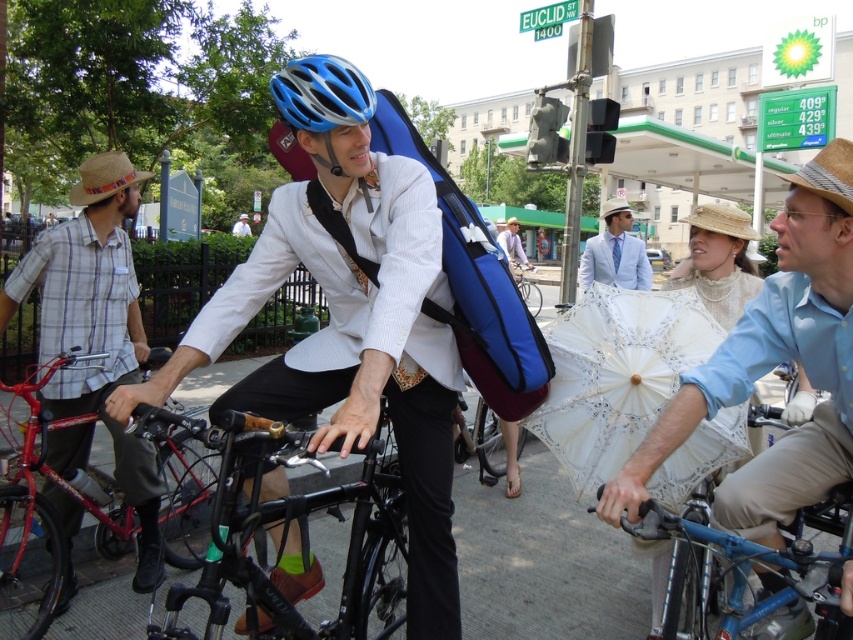
Question: Does gray concrete pavement at center lie behind light blue fabric suit at center?

Choices:
 (A) no
 (B) yes

Answer: (A)

Question: Which of the following is the farthest from the observer?

Choices:
 (A) (97, 227)
 (B) (636, 264)

Answer: (B)

Question: Which point appears farthest from the camera in this image?

Choices:
 (A) (334, 161)
 (B) (625, 209)

Answer: (B)

Question: Is plaid cotton shirt at left above white cotton shirt at center?

Choices:
 (A) yes
 (B) no

Answer: (B)

Question: From the image, what is the correct spatial relationship of matte blue helmet at center in relation to light blue cotton shirt at center?

Choices:
 (A) right
 (B) left

Answer: (B)

Question: Which of the following is the closest to the observer?

Choices:
 (A) blue matte bicycle helmet at center
 (B) white lace umbrella at center
 (C) plaid cotton shirt at left
 (D) silver metallic bicycle at center

Answer: (A)